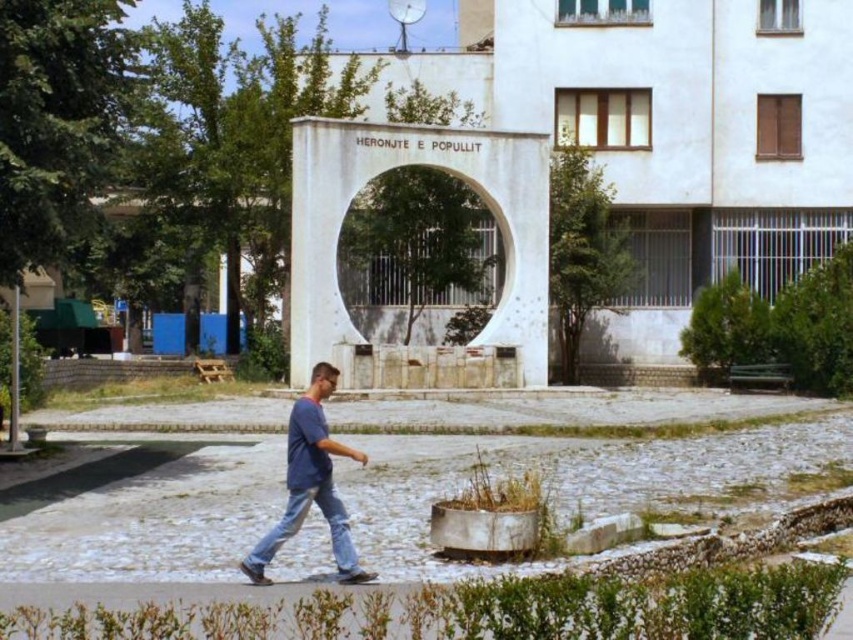
Can you confirm if white concrete archway at center is taller than denim at center?

Indeed, white concrete archway at center has a greater height compared to denim at center.

Which of these two, white concrete archway at center or denim at center, stands shorter?

denim at center is shorter.

Between point (457, 243) and point (267, 554), which one is positioned behind?

The point (457, 243) is more distant.

This screenshot has width=853, height=640. I want to click on white concrete archway at center, so click(415, 237).

Is point (306, 412) positioned behind point (329, 477)?

No, it is not.

Is point (305, 461) positioned after point (340, 538)?

No.

Locate an element on the screen. This screenshot has height=640, width=853. blue denim jeans at lower center is located at coordinates tap(310, 483).

This screenshot has width=853, height=640. What do you see at coordinates (415, 237) in the screenshot?
I see `white concrete archway at center` at bounding box center [415, 237].

Who is lower down, white concrete archway at center or blue denim jeans at lower center?

Positioned lower is blue denim jeans at lower center.

I want to click on white concrete archway at center, so click(x=415, y=237).

At what (x,y) coordinates should I click in order to perform the action: click on white concrete archway at center. Please return your answer as a coordinate pair (x, y). The image size is (853, 640). Looking at the image, I should click on (415, 237).